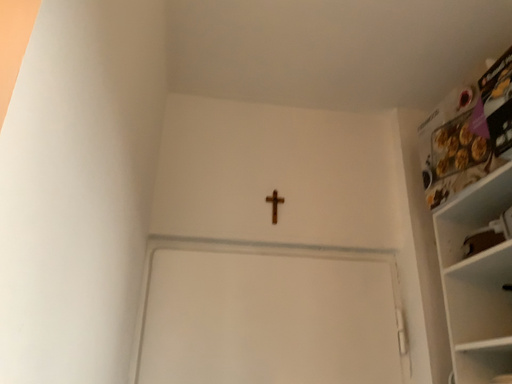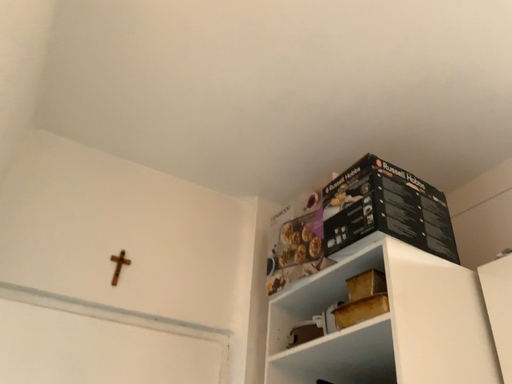
Question: How did the camera likely rotate when shooting the video?

Choices:
 (A) rotated downward
 (B) rotated upward

Answer: (B)